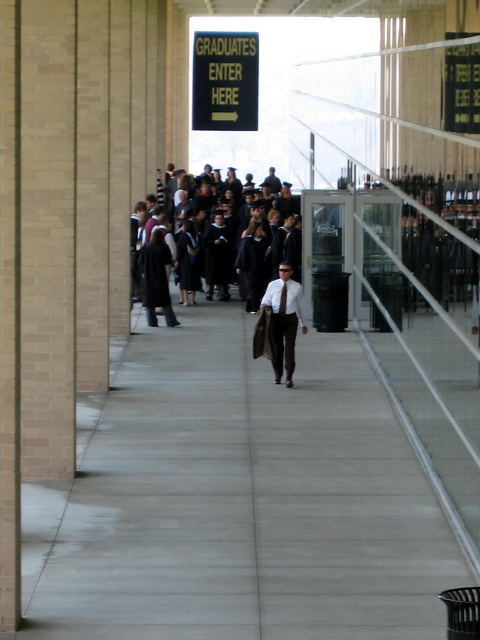
You are a graduate trying to find the entrance to the ceremony. There is a point marked at coordinates (225, 81). What does this point indicate?

The point at (225, 81) indicates a gold and black sign at upper center that reads GRADUATES ENTER HERE with a yellow arrow pointing to the right, indicating the entrance direction.

You are a photographer positioned at the end of the corridor. You need to capture a photo of the graduates in their black matte graduation gowns at center and the person wearing brown leather pants at center. Based on their positions, which subject should you adjust your camera focus to first to ensure both are in frame?

The brown leather pants at center is to the right of the black matte graduation gowns at center. Since the photographer is at the end of the corridor, they should focus on the black matte graduation gowns at center first as they are closer, then adjust to include the brown leather pants at center to the right.